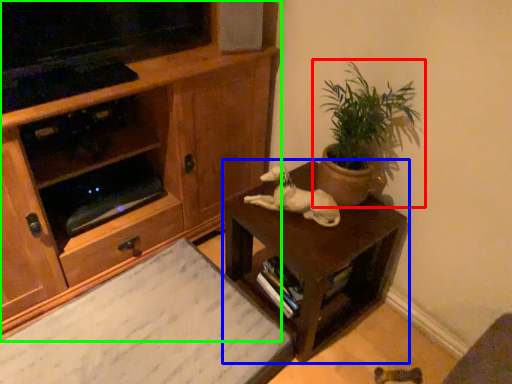
Question: Based on their relative distances, which object is farther from houseplant (highlighted by a red box)? Choose from table (highlighted by a blue box) and cabinetry (highlighted by a green box).

Choices:
 (A) table
 (B) cabinetry

Answer: (B)